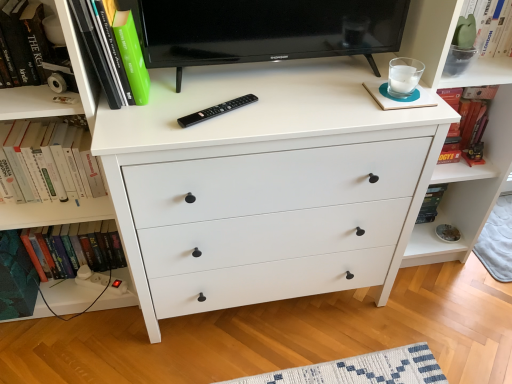
Question: Considering the relative sizes of green matte plant at upper right and green matte book at upper left, the first book from the top, in the image provided, is green matte plant at upper right shorter than green matte book at upper left, the first book from the top,?

Choices:
 (A) yes
 (B) no

Answer: (A)

Question: Is green matte plant at upper right closer to the viewer compared to green matte book at upper left, which appears as the third book when ordered from the bottom?

Choices:
 (A) no
 (B) yes

Answer: (A)

Question: From a real-world perspective, is green matte plant at upper right positioned over green matte book at upper left, the first book from the top, based on gravity?

Choices:
 (A) no
 (B) yes

Answer: (A)

Question: Would you consider green matte plant at upper right to be distant from green matte book at upper left, the first book from the top?

Choices:
 (A) yes
 (B) no

Answer: (B)

Question: Does green matte plant at upper right have a greater height compared to green matte book at upper left, which appears as the third book when ordered from the bottom?

Choices:
 (A) yes
 (B) no

Answer: (B)

Question: Does green matte plant at upper right appear on the left side of green matte book at upper left, which appears as the third book when ordered from the bottom?

Choices:
 (A) no
 (B) yes

Answer: (A)

Question: Is black plastic remote at center beside white plastic plug at lower left?

Choices:
 (A) no
 (B) yes

Answer: (A)

Question: Does black plastic remote at center have a lesser height compared to white plastic plug at lower left?

Choices:
 (A) no
 (B) yes

Answer: (B)

Question: Would you say white plastic plug at lower left is part of black plastic remote at center's contents?

Choices:
 (A) yes
 (B) no

Answer: (B)

Question: Is the depth of black plastic remote at center greater than that of white plastic plug at lower left?

Choices:
 (A) yes
 (B) no

Answer: (B)

Question: From a real-world perspective, is black plastic remote at center positioned under white plastic plug at lower left based on gravity?

Choices:
 (A) yes
 (B) no

Answer: (B)

Question: Is black plastic remote at center outside white plastic plug at lower left?

Choices:
 (A) yes
 (B) no

Answer: (A)

Question: Is green matte book at upper left, the first book from the top, thinner than green matte plant at upper right?

Choices:
 (A) yes
 (B) no

Answer: (B)